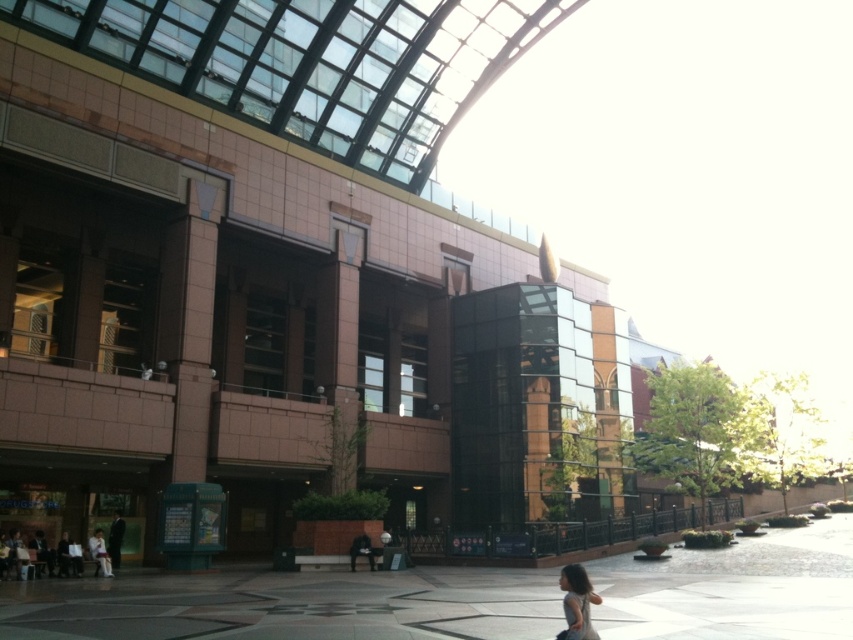
Is point (39, 586) farther from camera compared to point (567, 612)?

Yes, it is behind point (567, 612).

Can you confirm if polished concrete pavement at lower center is positioned to the right of matte black dress at lower right?

Incorrect, polished concrete pavement at lower center is not on the right side of matte black dress at lower right.

Between point (724, 618) and point (582, 634), which one is positioned behind?

Positioned behind is point (724, 618).

Where is `polished concrete pavement at lower center`? polished concrete pavement at lower center is located at coordinates (289, 605).

Is point (569, 573) positioned in front of point (109, 568)?

Yes.

Can you confirm if matte black dress at lower right is wider than light beige fabric jacket at lower left?

Yes.

Which is behind, point (566, 564) or point (102, 560)?

Point (566, 564)

Where is `matte black dress at lower right`? The width and height of the screenshot is (853, 640). matte black dress at lower right is located at coordinates (577, 602).

Looking at this image, can you confirm if polished concrete pavement at lower center is shorter than light beige fabric jacket at lower left?

No.

Is point (36, 609) farther from viewer compared to point (102, 544)?

No, (36, 609) is closer to viewer.

Is point (674, 636) closer to camera compared to point (109, 563)?

That is True.

Find the location of a particular element. The width and height of the screenshot is (853, 640). polished concrete pavement at lower center is located at coordinates (289, 605).